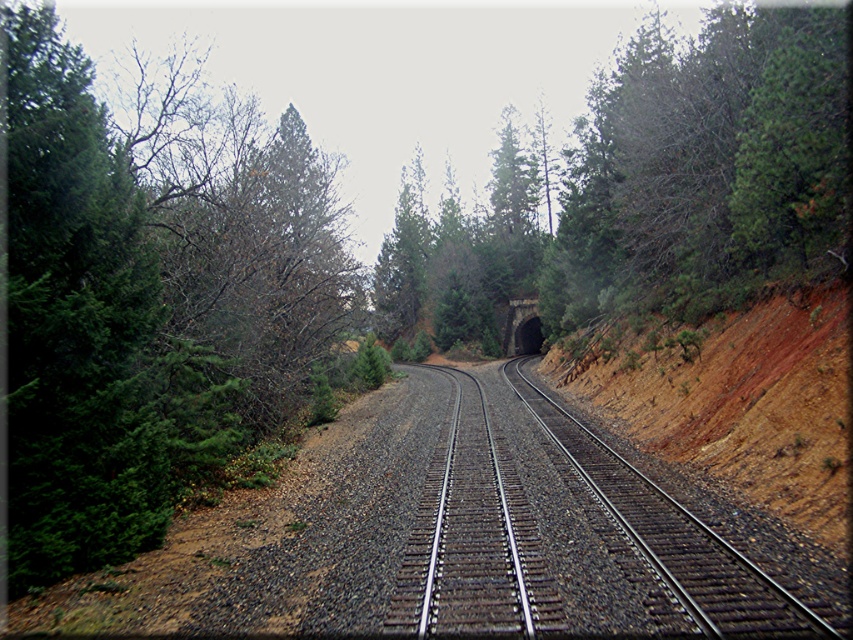
Question: Which object is closer to the camera taking this photo?

Choices:
 (A) dull reddish-brown dirt at center-right
 (B) green textured tree at center

Answer: (A)

Question: From the image, what is the correct spatial relationship of metal/smooth train tracks at center in relation to dull reddish-brown dirt at center-right?

Choices:
 (A) below
 (B) above

Answer: (A)

Question: Which object is positioned closest to the green textured tree at center?

Choices:
 (A) metal/smooth train tracks at center
 (B) dull reddish-brown dirt at center-right

Answer: (B)

Question: Is green textured tree at center positioned before metal/smooth train tracks at center?

Choices:
 (A) yes
 (B) no

Answer: (B)

Question: Considering the relative positions of green textured tree at center and dull reddish-brown dirt at center-right in the image provided, where is green textured tree at center located with respect to dull reddish-brown dirt at center-right?

Choices:
 (A) below
 (B) above

Answer: (B)

Question: Which of these objects is positioned closest to the dull reddish-brown dirt at center-right?

Choices:
 (A) metal/smooth train tracks at center
 (B) green textured tree at center

Answer: (A)